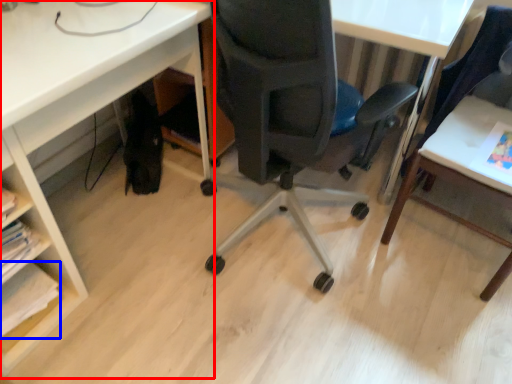
Question: Which point is further to the camera, desk (highlighted by a red box) or book (highlighted by a blue box)?

Choices:
 (A) desk
 (B) book

Answer: (B)